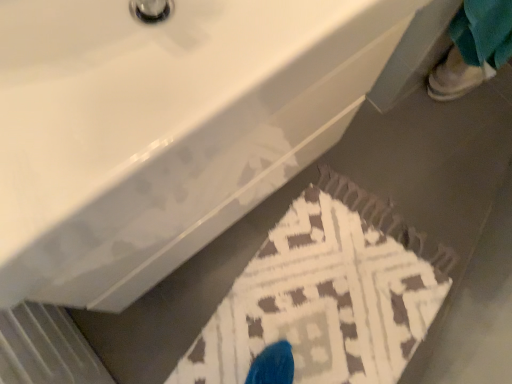
Question: From the image's perspective, would you say brown textured rug at lower center is shown under white leather shoe at upper right?

Choices:
 (A) yes
 (B) no

Answer: (A)

Question: Considering the relative sizes of brown textured rug at lower center and white leather shoe at upper right in the image provided, is brown textured rug at lower center bigger than white leather shoe at upper right?

Choices:
 (A) no
 (B) yes

Answer: (B)

Question: Could white leather shoe at upper right be considered to be inside brown textured rug at lower center?

Choices:
 (A) no
 (B) yes

Answer: (A)

Question: Considering the relative positions of brown textured rug at lower center and white leather shoe at upper right in the image provided, is brown textured rug at lower center to the right of white leather shoe at upper right from the viewer's perspective?

Choices:
 (A) no
 (B) yes

Answer: (A)

Question: Considering the relative sizes of brown textured rug at lower center and white leather shoe at upper right in the image provided, is brown textured rug at lower center smaller than white leather shoe at upper right?

Choices:
 (A) yes
 (B) no

Answer: (B)

Question: Is brown textured rug at lower center inside or outside of white leather shoe at upper right?

Choices:
 (A) inside
 (B) outside

Answer: (B)

Question: Is point [355, 259] positioned closer to the camera than point [485, 36]?

Choices:
 (A) farther
 (B) closer

Answer: (A)

Question: Is brown textured rug at lower center in front of or behind white leather shoe at upper right in the image?

Choices:
 (A) front
 (B) behind

Answer: (A)

Question: Considering the positions of brown textured rug at lower center and white leather shoe at upper right in the image, is brown textured rug at lower center taller or shorter than white leather shoe at upper right?

Choices:
 (A) short
 (B) tall

Answer: (A)

Question: In terms of size, does white leather shoe at upper right appear bigger or smaller than brown textured rug at lower center?

Choices:
 (A) small
 (B) big

Answer: (A)

Question: From the image's perspective, is white leather shoe at upper right positioned above or below brown textured rug at lower center?

Choices:
 (A) above
 (B) below

Answer: (A)

Question: Is white leather shoe at upper right inside or outside of brown textured rug at lower center?

Choices:
 (A) outside
 (B) inside

Answer: (A)

Question: Does point (505, 61) appear closer or farther from the camera than point (209, 375)?

Choices:
 (A) closer
 (B) farther

Answer: (A)

Question: Is point (313, 201) positioned closer to the camera than point (124, 231)?

Choices:
 (A) farther
 (B) closer

Answer: (A)

Question: From a real-world perspective, relative to white glossy sink at upper center, is brown textured rug at lower center vertically above or below?

Choices:
 (A) below
 (B) above

Answer: (A)